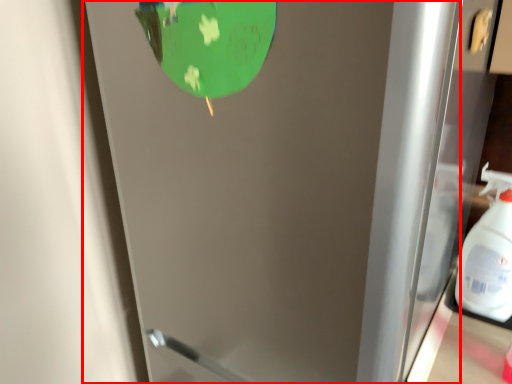
Question: Where is door (annotated by the red box) located in relation to cleaning product in the image?

Choices:
 (A) left
 (B) right

Answer: (A)